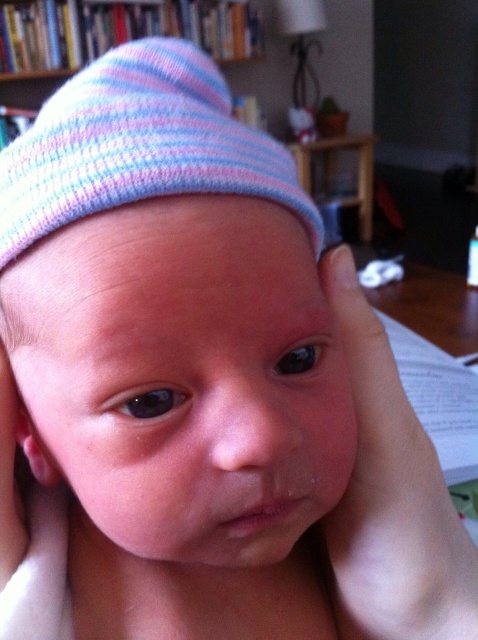
Is point (442, 548) less distant than point (249, 36)?

Yes, point (442, 548) is closer to viewer.

Describe the element at coordinates (391, 497) in the screenshot. Image resolution: width=478 pixels, height=640 pixels. I see `smooth skin hand at center` at that location.

Identify the location of smooth skin hand at center. The width and height of the screenshot is (478, 640). (391, 497).